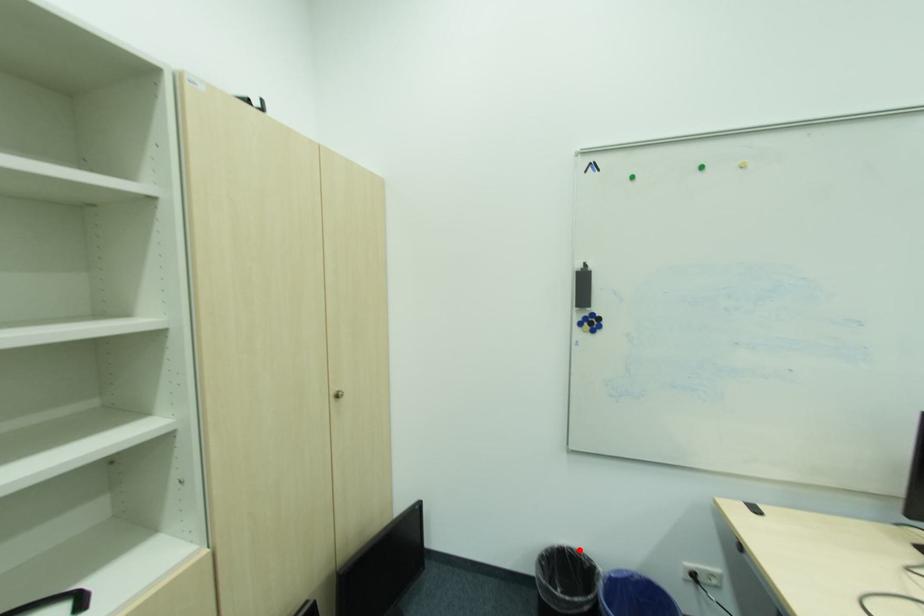
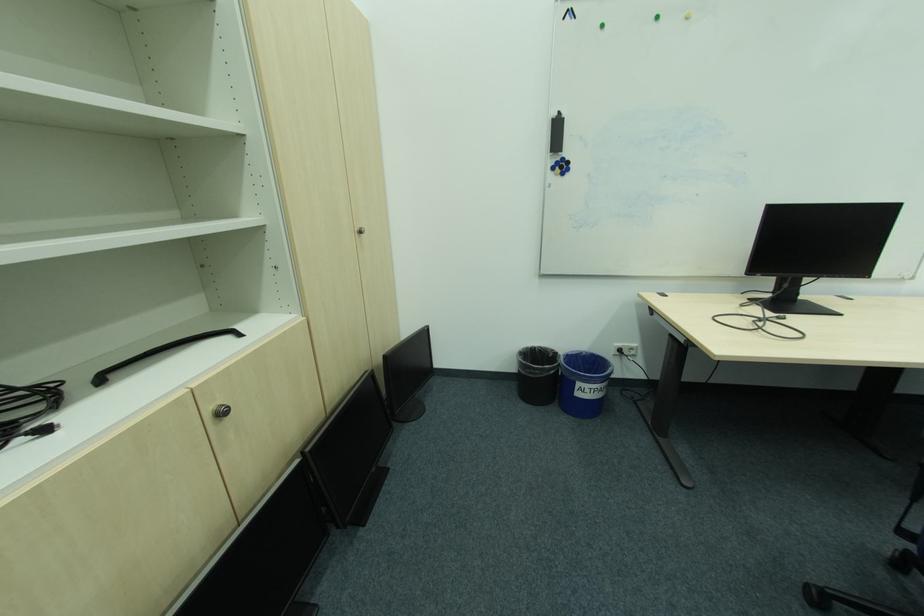
Locate, in the second image, the point that corresponds to the highlighted location in the first image.

(546, 347)